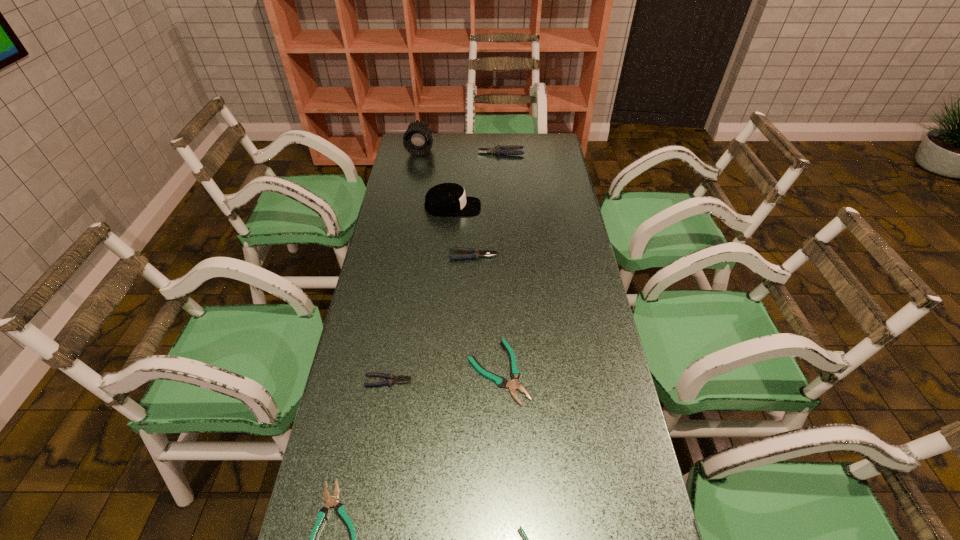
What are the coordinates of `the farthest teal pliers` in the screenshot? It's located at (513, 385).

I want to click on the biggest teal pliers, so click(x=513, y=385).

Image resolution: width=960 pixels, height=540 pixels. What are the coordinates of `vacant space situated 0.200m at the front element of the telephoto lens` in the screenshot? It's located at (415, 182).

Image resolution: width=960 pixels, height=540 pixels. I want to click on vacant space located on the front-facing side of the cap, so click(x=540, y=207).

What are the coordinates of `vacant space located at the gripping part of the sixth shortest object` in the screenshot? It's located at (454, 153).

Find the location of `vacant space located 0.050m at the gripping part of the sixth shortest object`. vacant space located 0.050m at the gripping part of the sixth shortest object is located at coordinates (467, 153).

Locate an element on the screen. The image size is (960, 540). vacant position located at the gripping part of the sixth shortest object is located at coordinates (423, 153).

Locate an element on the screen. vacant space located at the gripping part of the fourth farthest object is located at coordinates (569, 255).

Find the location of a particular element. Image resolution: width=960 pixels, height=540 pixels. vacant space located 0.160m at the gripping part of the leftmost gray pliers is located at coordinates (470, 381).

Find the location of a particular element. This screenshot has height=540, width=960. vacant space located on the right of the biggest teal pliers is located at coordinates (616, 372).